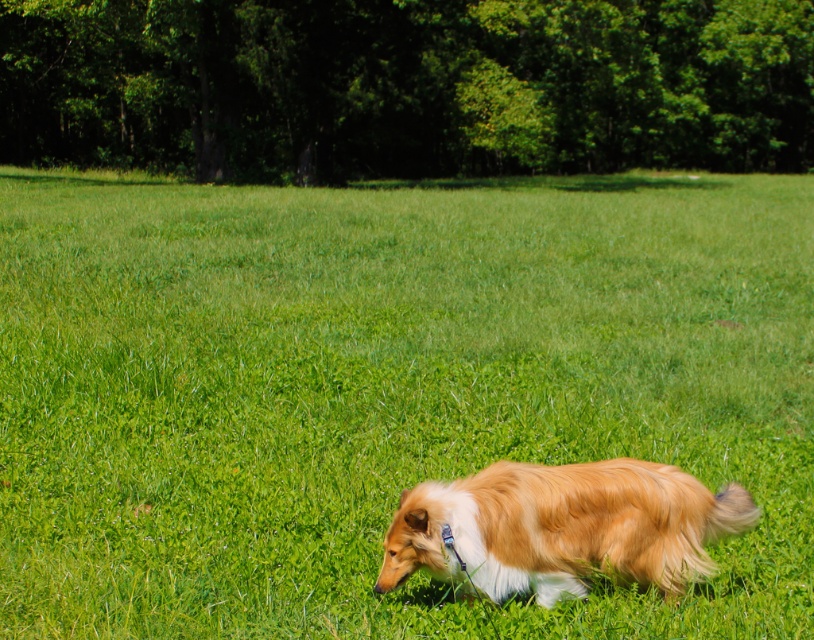
You are standing in the middle of the green grassy field at center and see the golden fur dog at center. Which one is closer to you?

The green grassy field at center is closer to you because the golden fur dog at center is behind it.

You are a hiker who wants to take a nap on the green grassy field at center. However, you notice the golden fur dog at center nearby. Considering their heights, which object would be more visible from above when lying down?

The green grassy field at center has a greater height compared to the golden fur dog at center, so when lying down, the golden fur dog at center would be more visible from above since it is taller than the grass.